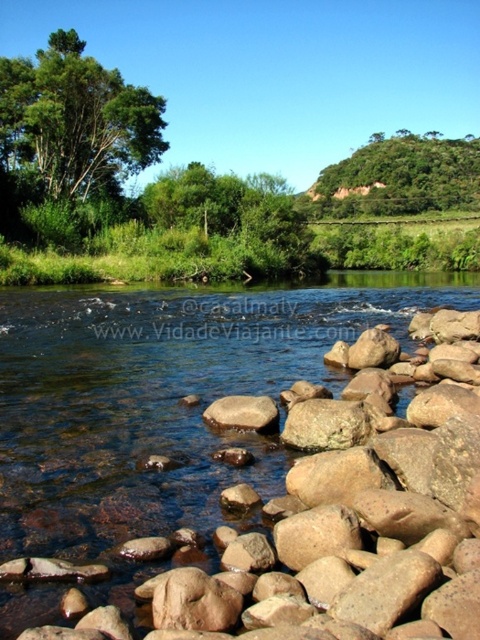
You are standing at the edge of the river and see two points in the water. The first point is at coordinates point (10, 456) and the second is at point (103, 106). Which point is closer to you?

Point (10, 456) is closer to the camera than point (103, 106), so the first point is closer to you.

You are standing at the edge of the river and see the brown rough rock at lower center and the smooth brown rock at center. Which rock is nearer to you?

The brown rough rock at lower center is closer to the viewer than the smooth brown rock at center.